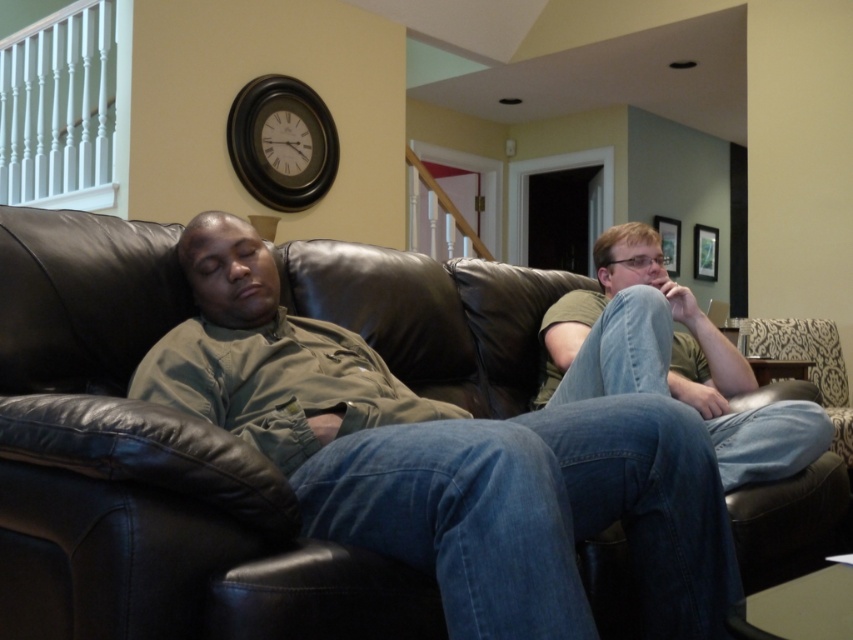
You are a furniture designer evaluating the layout of this living room. The black leather couch at center and denim jeans at right are part of the design. Considering their sizes, which object would you suggest replacing to optimize space efficiency?

The black leather couch at center is smaller than denim jeans at right. To optimize space efficiency, replacing the denim jeans at right with a smaller piece of furniture would be more effective since the denim jeans at right takes up more space.

You are standing in the living room and want to place a small plant between the two points, point [239,529] and point [724,396]. Which point should the plant be closer to in order to be closer to the viewer?

The plant should be placed closer to point [239,529] because it is closer to the viewer than point [724,396].

You are standing in the living room and want to place a small table between the black leather couch at center and the denim jeans at right. Based on their positions, which object is closer to you so that the table can be placed in between?

The black leather couch at center is closer to you than the denim jeans at right, so the table can be placed between them.